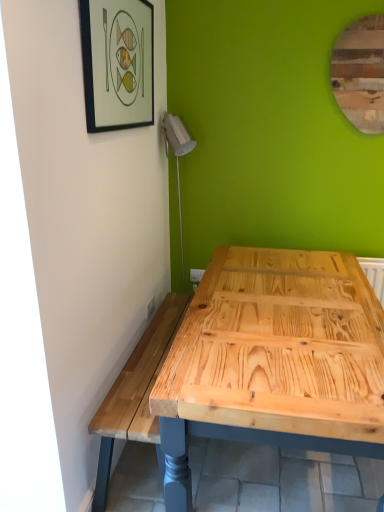
Question: Is wooden mirror at upper right wider or thinner than matte black picture frame at upper left?

Choices:
 (A) thin
 (B) wide

Answer: (A)

Question: From the image's perspective, relative to matte black picture frame at upper left, is wooden mirror at upper right above or below?

Choices:
 (A) below
 (B) above

Answer: (B)

Question: From a real-world perspective, is wooden mirror at upper right positioned above or below matte black picture frame at upper left?

Choices:
 (A) below
 (B) above

Answer: (B)

Question: Which is correct: matte black picture frame at upper left is inside wooden mirror at upper right, or outside of it?

Choices:
 (A) outside
 (B) inside

Answer: (A)

Question: In terms of width, does matte black picture frame at upper left look wider or thinner when compared to wooden mirror at upper right?

Choices:
 (A) wide
 (B) thin

Answer: (A)

Question: Based on their positions, is matte black picture frame at upper left located to the left or right of wooden mirror at upper right?

Choices:
 (A) left
 (B) right

Answer: (A)

Question: From the image's perspective, is matte black picture frame at upper left located above or below wooden mirror at upper right?

Choices:
 (A) below
 (B) above

Answer: (A)